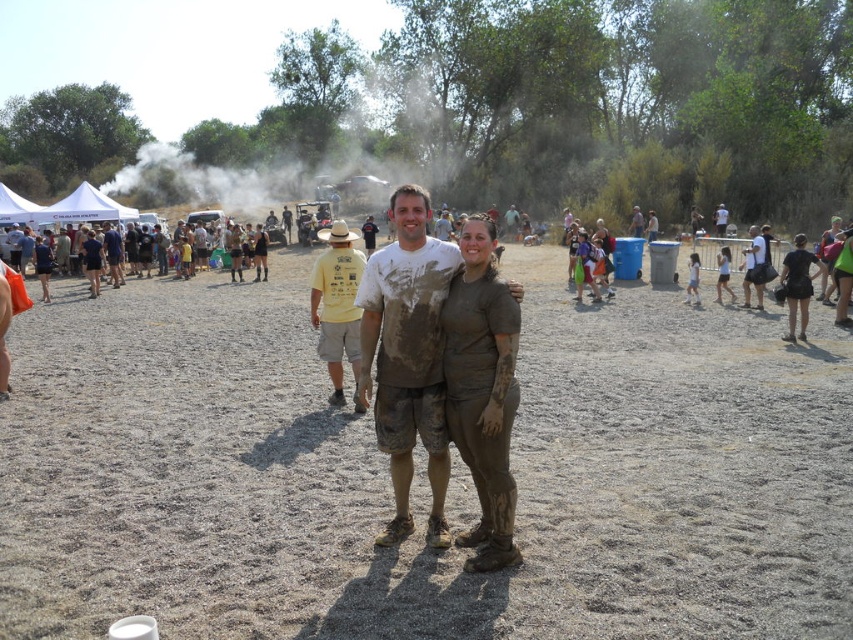
Is point (451, 152) less distant than point (410, 244)?

No, it is behind (410, 244).

Can you confirm if white smoke at upper center is positioned to the right of muddy t-shirt at center?

In fact, white smoke at upper center is to the left of muddy t-shirt at center.

Is point (274, 170) positioned behind point (395, 412)?

Yes, point (274, 170) is farther from viewer.

This screenshot has height=640, width=853. I want to click on white smoke at upper center, so click(299, 156).

Is dusty brown ground at center below muddy t-shirt at center?

Yes, dusty brown ground at center is below muddy t-shirt at center.

This screenshot has width=853, height=640. Describe the element at coordinates (421, 474) in the screenshot. I see `dusty brown ground at center` at that location.

Who is more forward, (282, 364) or (404, 532)?

Point (404, 532)

You are a GUI agent. You are given a task and a screenshot of the screen. Output one action in this format:
    pyautogui.click(x=<x>, y=<y>)
    Task: Click on the dusty brown ground at center
    Image resolution: width=853 pixels, height=640 pixels.
    Given the screenshot: What is the action you would take?
    pyautogui.click(x=421, y=474)

Which is more to the left, dusty brown ground at center or white smoke at upper center?

From the viewer's perspective, white smoke at upper center appears more on the left side.

Does dusty brown ground at center appear under white smoke at upper center?

Correct, dusty brown ground at center is located below white smoke at upper center.

Between point (732, 452) and point (222, 148), which one is positioned in front?

Positioned in front is point (732, 452).

The image size is (853, 640). I want to click on dusty brown ground at center, so click(x=421, y=474).